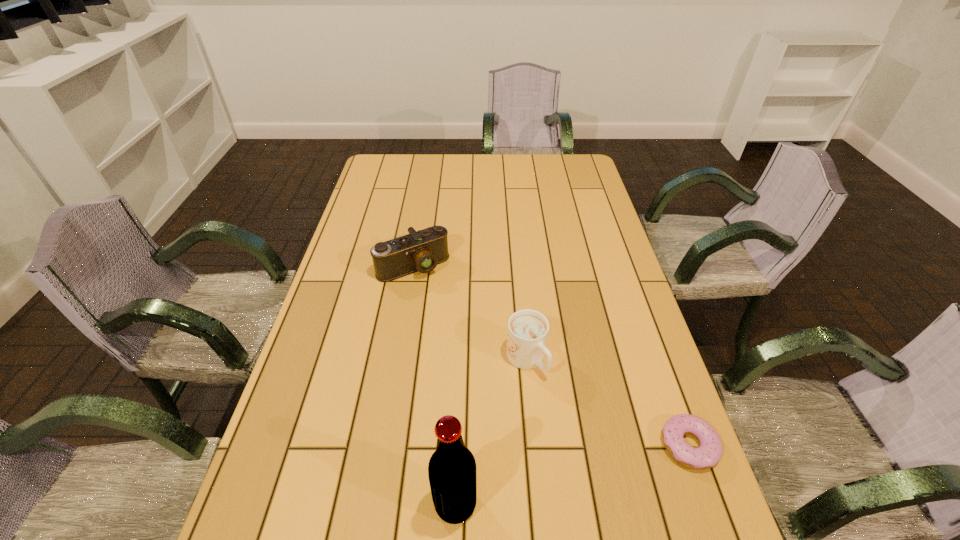
This screenshot has width=960, height=540. In order to click on blank area located on the side with the handle of the cappuccino in this screenshot , I will do `click(637, 503)`.

Locate an element on the screen. vacant space located 0.350m on the side with the handle of the cappuccino is located at coordinates (645, 513).

Find the location of a particular element. vacant region located on the side with the handle of the cappuccino is located at coordinates (567, 415).

This screenshot has width=960, height=540. I want to click on vacant space located 0.400m on the lens of the leftmost object, so click(x=497, y=380).

Identify the location of vacant space located 0.160m on the lens of the leftmost object. This screenshot has height=540, width=960. (452, 315).

The image size is (960, 540). I want to click on vacant space situated 0.170m on the lens of the leftmost object, so click(x=454, y=318).

Where is `object that is at the near edge`? object that is at the near edge is located at coordinates (452, 467).

Image resolution: width=960 pixels, height=540 pixels. I want to click on object located in the left edge section of the desktop, so click(x=422, y=250).

In order to click on object located at the right edge in this screenshot , I will do `click(708, 454)`.

Locate an element on the screen. Image resolution: width=960 pixels, height=540 pixels. free location at the far edge is located at coordinates (483, 158).